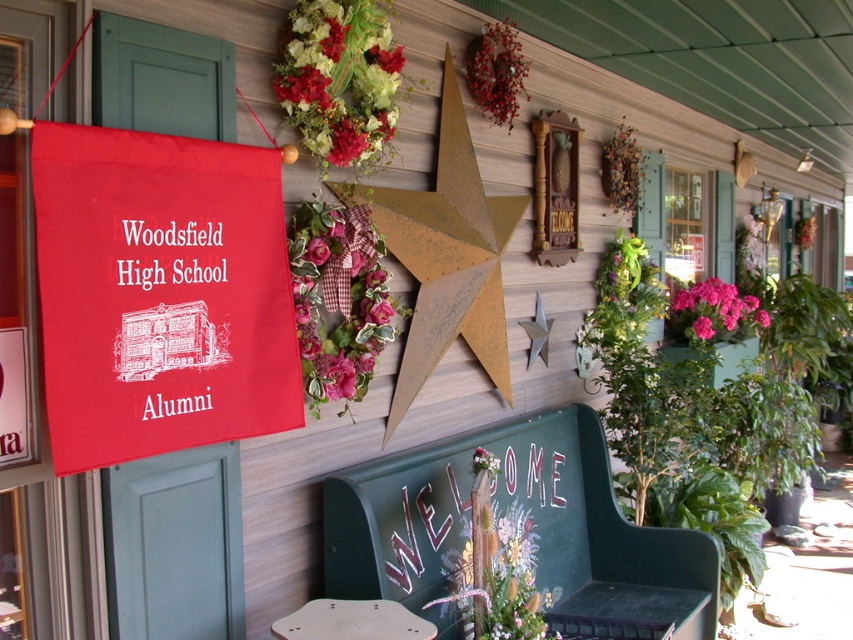
You are planning to place a new decorative item on the porch. You have a small decorative item that needs to fit between the floral bouquet at upper center and the pink matte flowers at right. Based on their sizes, which object should the new item be placed closer to?

The floral bouquet at upper center is smaller than the pink matte flowers at right, so the new item should be placed closer to the floral bouquet at upper center to ensure proper spacing.

You are planning to place a decorative item on the porch. You have a new decoration that is 10 inches wide. The red berry wreath at upper center and the pink matte flowers at right are already present. Which existing decoration can accommodate your new item without overlapping?

The pink matte flowers at right have a greater width than the red berry wreath at upper center, so the new decoration of 10 inches can be placed near the pink matte flowers at right if their width allows sufficient space.